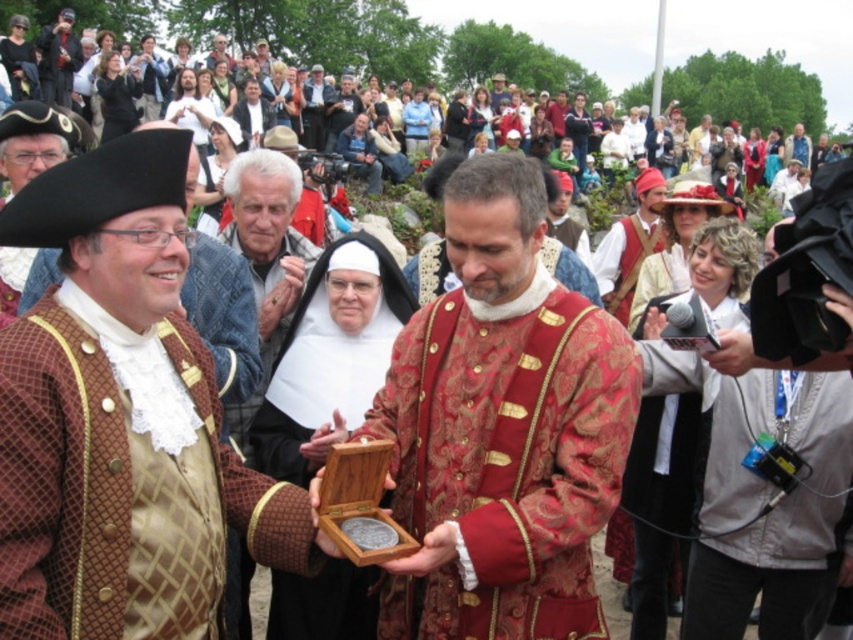
Question: Is wooden box at center bigger than matte black camera at center?

Choices:
 (A) no
 (B) yes

Answer: (A)

Question: Which of the following is the farthest from the observer?

Choices:
 (A) (312, 68)
 (B) (437, 600)
 (C) (306, 52)

Answer: (C)

Question: Which point is farther to the camera?

Choices:
 (A) brown textured coat at center
 (B) white clothed nun at center

Answer: (B)

Question: Which object is farther from the camera taking this photo?

Choices:
 (A) brown textured coat at center
 (B) shiny gold brocade coat at center
 (C) gray hair man at center

Answer: (C)

Question: Is gray hair man at center bigger than matte black camera at center?

Choices:
 (A) yes
 (B) no

Answer: (B)

Question: Is wooden box at center above gray hair man at center?

Choices:
 (A) no
 (B) yes

Answer: (A)